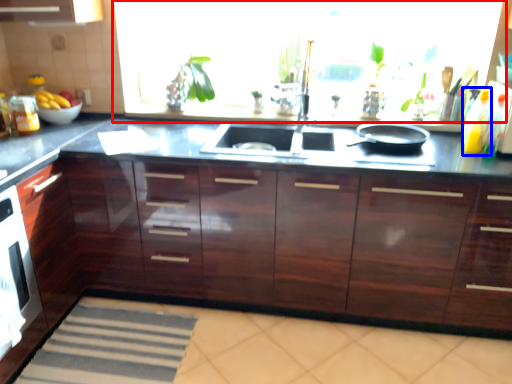
Question: Which object appears closest to the camera in this image, window screen (highlighted by a red box) or bottle (highlighted by a blue box)?

Choices:
 (A) window screen
 (B) bottle

Answer: (B)